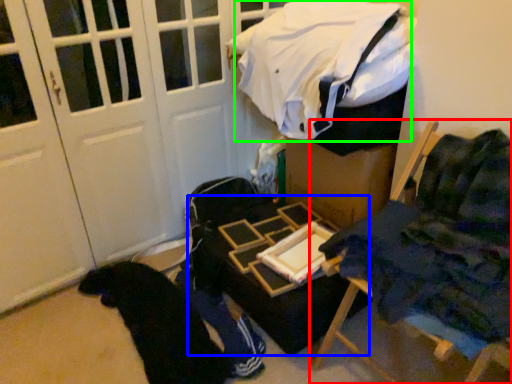
Question: Which is farther away from furniture (highlighted by a red box)? table (highlighted by a blue box) or laundry (highlighted by a green box)?

Choices:
 (A) table
 (B) laundry

Answer: (B)